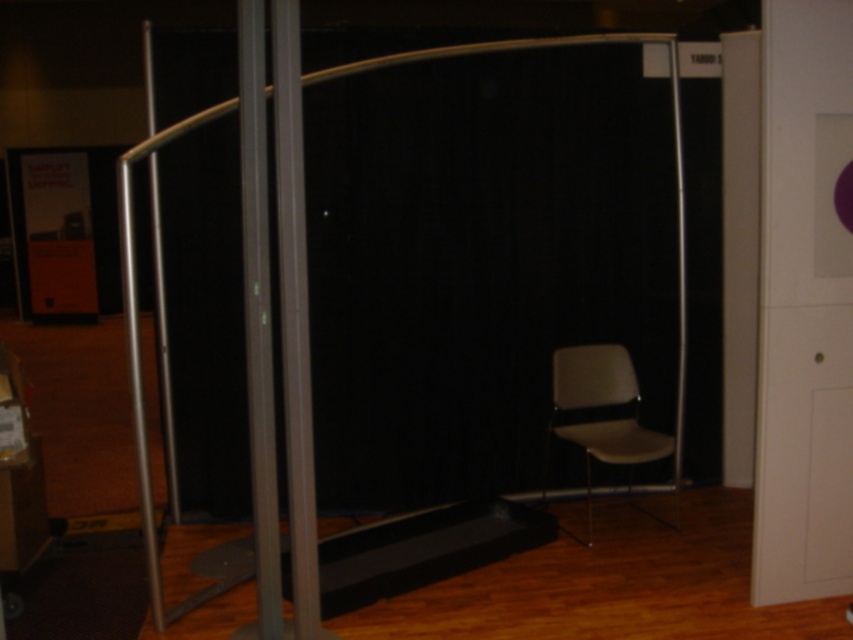
Question: Is transparent glass door at center wider than metallic gray pole at center?

Choices:
 (A) no
 (B) yes

Answer: (B)

Question: Estimate the real-world distances between objects in this image. Which object is farther from the metallic silver pole at center?

Choices:
 (A) metallic gray pole at center
 (B) transparent glass door at center

Answer: (B)

Question: Considering the real-world distances, which object is farthest from the transparent glass door at center?

Choices:
 (A) metallic gray pole at center
 (B) gray plastic swivel chair at right
 (C) metallic silver pole at center

Answer: (B)

Question: Is metallic gray pole at center smaller than gray plastic swivel chair at right?

Choices:
 (A) yes
 (B) no

Answer: (A)

Question: Does metallic silver pole at center have a greater width compared to gray plastic swivel chair at right?

Choices:
 (A) yes
 (B) no

Answer: (B)

Question: Which point is closer to the camera taking this photo?

Choices:
 (A) (328, 68)
 (B) (614, 403)

Answer: (A)